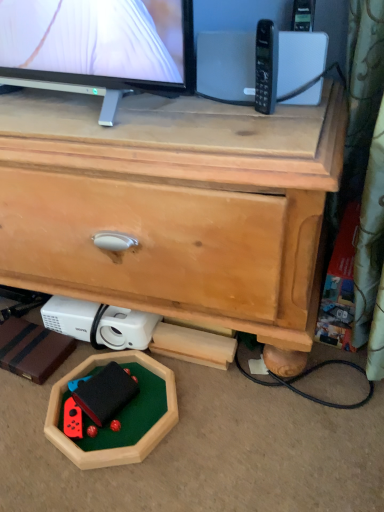
You are a GUI agent. You are given a task and a screenshot of the screen. Output one action in this format:
    pyautogui.click(x=<x>, y=<y>)
    Task: Click on the empty space that is ontop of wooden chest of drawers at center (from a real-world perspective)
    The width and height of the screenshot is (384, 512).
    Given the screenshot: What is the action you would take?
    pyautogui.click(x=136, y=115)